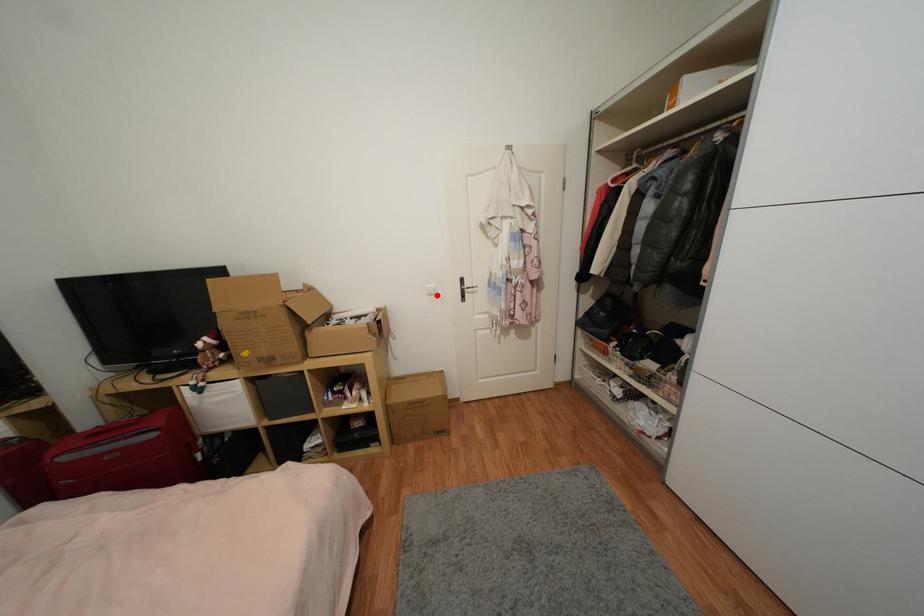
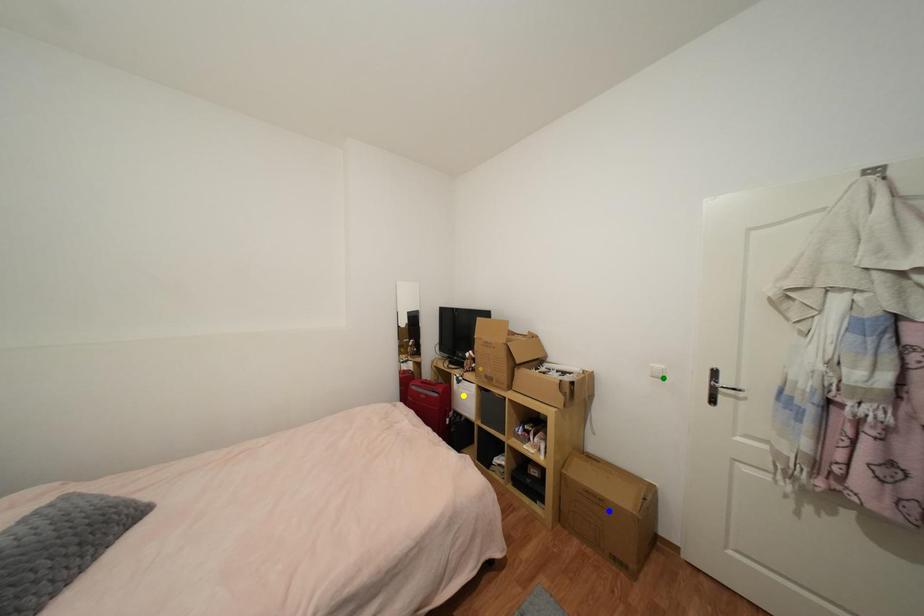
Question: I am providing you with two images of the same scene from different viewpoints. A red point is marked on the first image. You are given multiple points on the second image. Which point in image 2 represents the same 3d spot as the red point in image 1?

Choices:
 (A) blue point
 (B) green point
 (C) yellow point

Answer: (B)